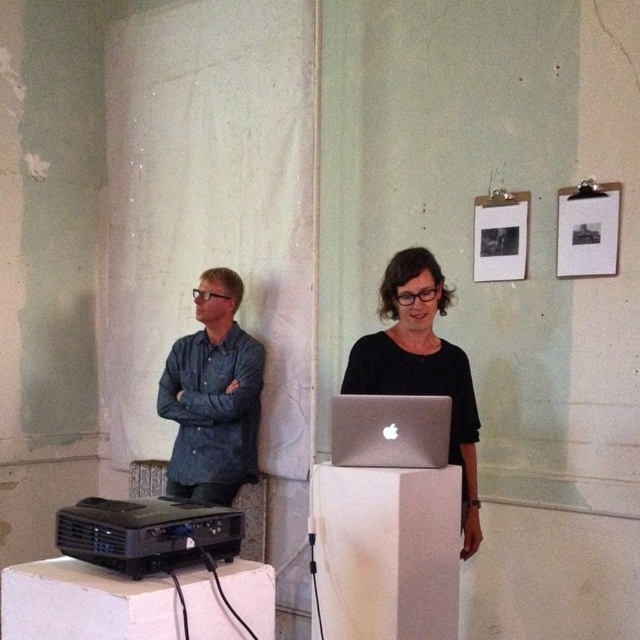
You are organizing a small event and need to place a new decorative item between the denim shirt at left and the silver metallic laptop at center. Considering their sizes, which object should the new item be placed closer to?

The denim shirt at left has a larger size compared to the silver metallic laptop at center, so the new decorative item should be placed closer to the silver metallic laptop at center to balance the space.

You are organizing a small event and need to place a 1.2 meter wide banner between the denim shirt at left and the black matte laptop at center. Can the space accommodate the banner?

The denim shirt at left is wider than the black matte laptop at center, but the exact distance between them isn

You are setting up a presentation and need to place a name tag on the tallest object between the denim shirt at left and the silver metallic laptop at center. Which object should you choose?

The denim shirt at left is taller than the silver metallic laptop at center, so you should place the name tag on the denim shirt at left.